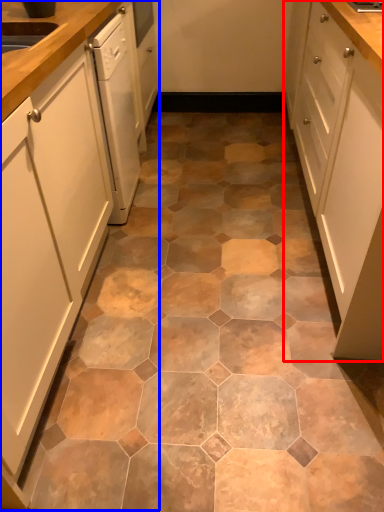
Question: Which object is further to the camera taking this photo, cabinetry (highlighted by a red box) or cabinetry (highlighted by a blue box)?

Choices:
 (A) cabinetry
 (B) cabinetry

Answer: (A)